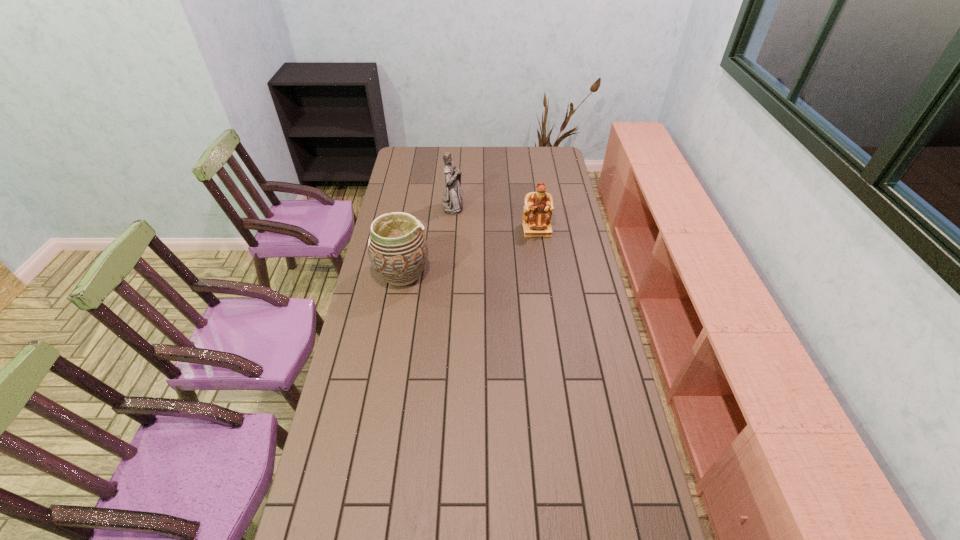
This screenshot has width=960, height=540. What are the coordinates of `object at the right edge` in the screenshot? It's located at (538, 208).

The width and height of the screenshot is (960, 540). Identify the location of blank space at the left edge of the desktop. (396, 170).

The height and width of the screenshot is (540, 960). I want to click on free spot at the right edge of the desktop, so click(x=574, y=253).

The image size is (960, 540). Identify the location of vacant region at the far left corner. (416, 146).

The height and width of the screenshot is (540, 960). In order to click on free spot at the far right corner of the desktop in this screenshot , I will do `click(540, 161)`.

Image resolution: width=960 pixels, height=540 pixels. I want to click on free spot between the leftmost object and the taller figurine, so click(x=428, y=240).

This screenshot has width=960, height=540. Find the location of `vacant area between the second farthest object and the leftmost object`. vacant area between the second farthest object and the leftmost object is located at coordinates (469, 252).

I want to click on blank region between the leftmost object and the rightmost object, so (469, 252).

Locate an element on the screen. The width and height of the screenshot is (960, 540). free space between the farthest object and the nearer figurine is located at coordinates (495, 218).

This screenshot has height=540, width=960. What are the coordinates of `the closest object to the right figurine` in the screenshot? It's located at (452, 204).